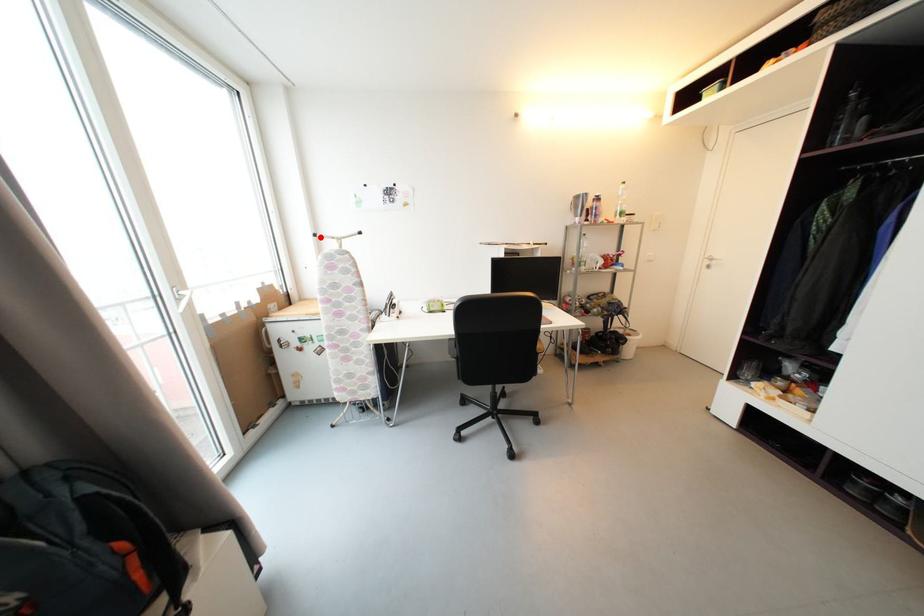
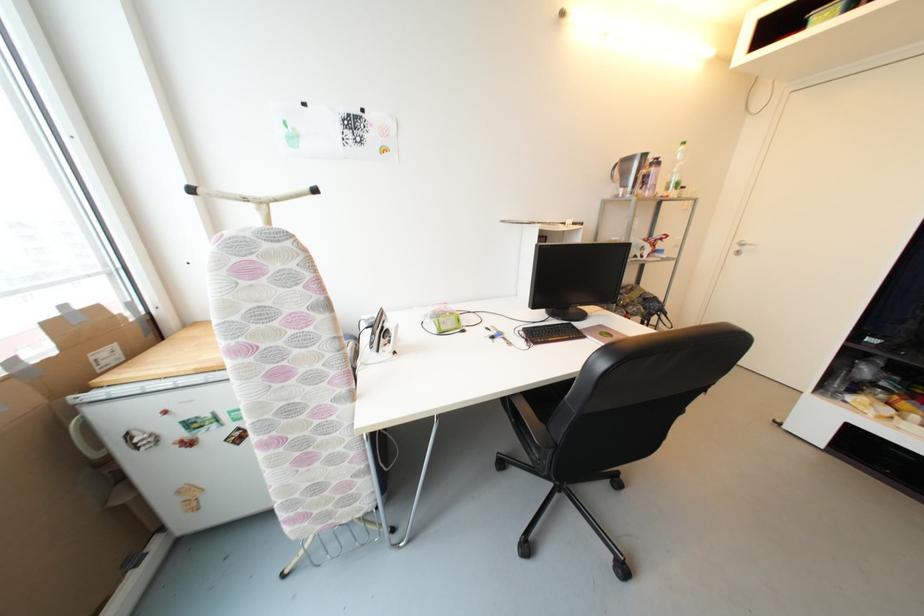
The point at the highlighted location is marked in the first image. Where is the corresponding point in the second image?

(197, 192)